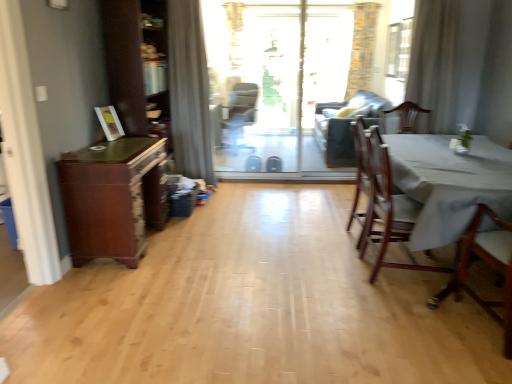
Question: From the image's perspective, is dark gray fabric couch at center beneath transparent glass window screen at upper right?

Choices:
 (A) yes
 (B) no

Answer: (A)

Question: Could you tell me if dark gray fabric couch at center is facing transparent glass window screen at upper right?

Choices:
 (A) yes
 (B) no

Answer: (B)

Question: Considering the relative sizes of dark gray fabric couch at center and transparent glass window screen at upper right in the image provided, is dark gray fabric couch at center smaller than transparent glass window screen at upper right?

Choices:
 (A) yes
 (B) no

Answer: (B)

Question: Does dark gray fabric couch at center have a lesser height compared to transparent glass window screen at upper right?

Choices:
 (A) no
 (B) yes

Answer: (A)

Question: From a real-world perspective, is dark gray fabric couch at center beneath transparent glass window screen at upper right?

Choices:
 (A) yes
 (B) no

Answer: (A)

Question: Is dark gray fabric couch at center wider than transparent glass window screen at upper right?

Choices:
 (A) yes
 (B) no

Answer: (A)

Question: Is wooden chair at right, the second chair when ordered from back to front, surrounded by brown wood cabinet at left?

Choices:
 (A) yes
 (B) no

Answer: (B)

Question: Does brown wood cabinet at left appear on the left side of wooden chair at right, the second chair when ordered from back to front?

Choices:
 (A) no
 (B) yes

Answer: (B)

Question: Is brown wood cabinet at left beside wooden chair at right, the 2th chair from the front?

Choices:
 (A) yes
 (B) no

Answer: (B)

Question: Can you confirm if brown wood cabinet at left is thinner than wooden chair at right, the 2th chair from the front?

Choices:
 (A) yes
 (B) no

Answer: (A)

Question: Can you confirm if brown wood cabinet at left is shorter than wooden chair at right, the 2th chair from the front?

Choices:
 (A) yes
 (B) no

Answer: (A)

Question: From a real-world perspective, is brown wood cabinet at left positioned over wooden chair at right, the 2th chair from the front, based on gravity?

Choices:
 (A) yes
 (B) no

Answer: (B)

Question: Can you confirm if gray fabric curtain at upper center, positioned as the first curtain in left-to-right order, is taller than white sheer curtain at upper right, which is counted as the 2th curtain, starting from the left?

Choices:
 (A) yes
 (B) no

Answer: (A)